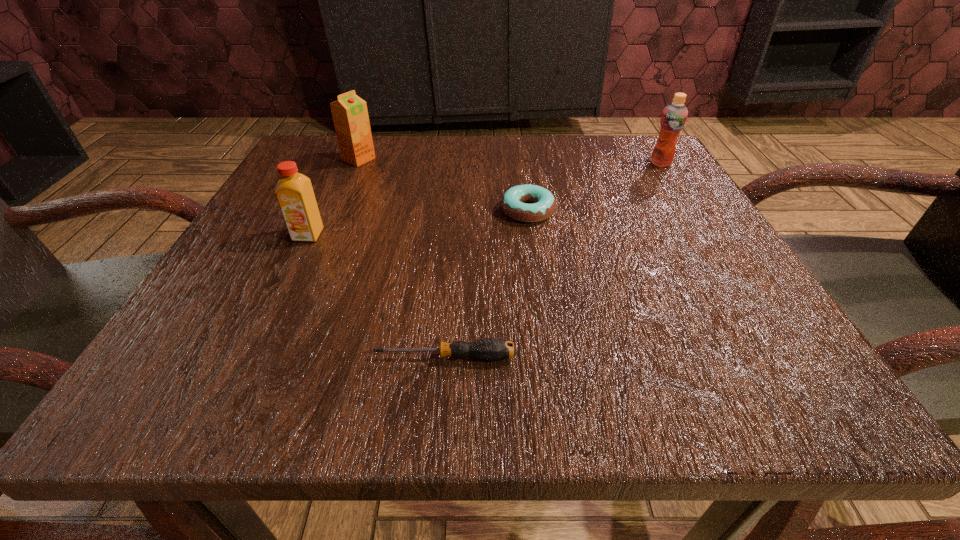
The height and width of the screenshot is (540, 960). Identify the location of vacant area at the near right corner of the desktop. [x=687, y=350].

The image size is (960, 540). In order to click on free space between the rightmost object and the third farthest object in this screenshot , I will do `click(594, 187)`.

Identify the location of vacant space in between the rightmost orange juice and the doughnut. (594, 187).

In order to click on empty location between the rightmost object and the fourth farthest object in this screenshot , I will do `click(485, 199)`.

Identify the location of vacant space in between the fourth farthest object and the screwdriver. (376, 296).

Find the location of a particular element. Image resolution: width=960 pixels, height=540 pixels. vacant area between the screwdriver and the doughnut is located at coordinates (487, 284).

Locate an element on the screen. empty location between the second nearest object and the rightmost object is located at coordinates (485, 199).

The width and height of the screenshot is (960, 540). I want to click on free space between the rightmost orange juice and the nearest object, so click(553, 260).

Identify which object is the fourth nearest to the rightmost orange juice. Please provide its 2D coordinates. Your answer should be formatted as a tuple, i.e. [(x, y)], where the tuple contains the x and y coordinates of a point satisfying the conditions above.

[(294, 192)]

The image size is (960, 540). In order to click on the fourth closest object to the third nearest object in this screenshot , I will do `click(294, 192)`.